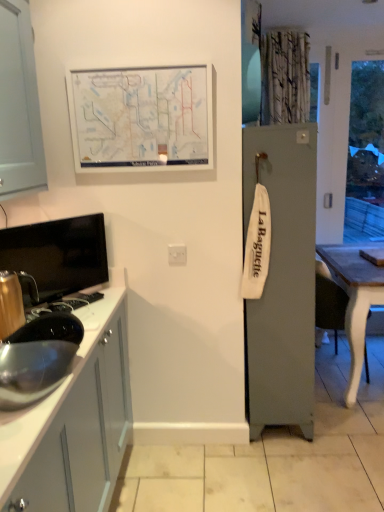
You are a GUI agent. You are given a task and a screenshot of the screen. Output one action in this format:
    pyautogui.click(x=<x>, y=<y>)
    Task: Click on the vacant point above satin silver sink at lower left (from a real-world perspective)
    This screenshot has width=384, height=512.
    Given the screenshot: What is the action you would take?
    pyautogui.click(x=39, y=224)